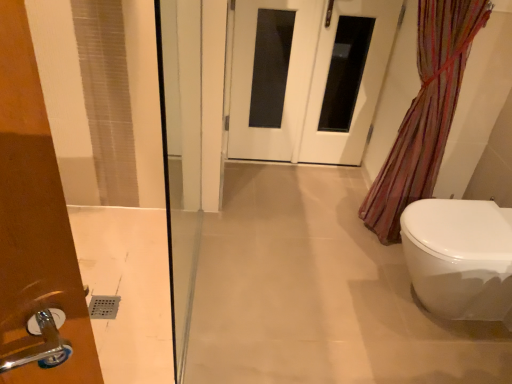
Question: Can we say white glossy door at center lies outside white glossy toilet at lower right?

Choices:
 (A) no
 (B) yes

Answer: (B)

Question: Does white glossy door at center lie behind white glossy toilet at lower right?

Choices:
 (A) yes
 (B) no

Answer: (A)

Question: Does white glossy door at center have a lesser height compared to white glossy toilet at lower right?

Choices:
 (A) yes
 (B) no

Answer: (B)

Question: Considering the relative sizes of white glossy door at center and white glossy toilet at lower right in the image provided, is white glossy door at center taller than white glossy toilet at lower right?

Choices:
 (A) no
 (B) yes

Answer: (B)

Question: Considering the relative positions of white glossy door at center and white glossy toilet at lower right in the image provided, is white glossy door at center to the left of white glossy toilet at lower right from the viewer's perspective?

Choices:
 (A) no
 (B) yes

Answer: (B)

Question: Considering the positions of white glossy door at center and white glossy door at center in the image, is white glossy door at center wider or thinner than white glossy door at center?

Choices:
 (A) thin
 (B) wide

Answer: (B)

Question: Visually, is white glossy door at center positioned to the left or to the right of white glossy door at center?

Choices:
 (A) right
 (B) left

Answer: (A)

Question: Based on their sizes in the image, would you say white glossy door at center is bigger or smaller than white glossy door at center?

Choices:
 (A) big
 (B) small

Answer: (A)

Question: In terms of height, does white glossy door at center look taller or shorter compared to white glossy door at center?

Choices:
 (A) short
 (B) tall

Answer: (B)

Question: From a real-world perspective, relative to white glossy toilet at lower right, is translucent striped fabric at right vertically above or below?

Choices:
 (A) below
 (B) above

Answer: (B)

Question: Relative to white glossy toilet at lower right, is translucent striped fabric at right in front or behind?

Choices:
 (A) front
 (B) behind

Answer: (A)

Question: From their relative heights in the image, would you say translucent striped fabric at right is taller or shorter than white glossy toilet at lower right?

Choices:
 (A) short
 (B) tall

Answer: (B)

Question: Does point (388, 210) appear closer or farther from the camera than point (501, 221)?

Choices:
 (A) farther
 (B) closer

Answer: (A)

Question: Is translucent striped fabric at right taller or shorter than white glossy door at center?

Choices:
 (A) short
 (B) tall

Answer: (B)

Question: From the image's perspective, is translucent striped fabric at right positioned above or below white glossy door at center?

Choices:
 (A) above
 (B) below

Answer: (B)